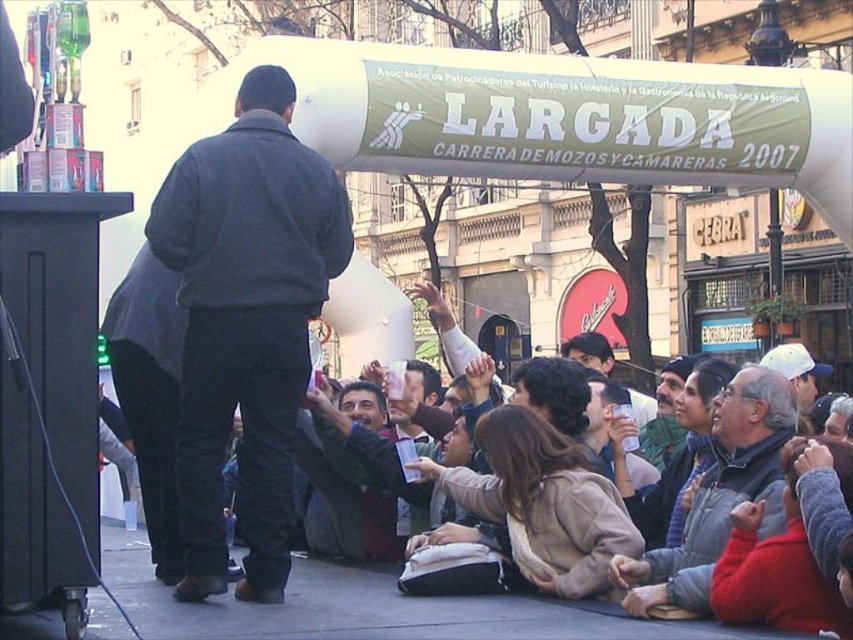
Question: Which object appears closest to the camera in this image?

Choices:
 (A) concrete pavement at lower center
 (B) smooth brown jacket at center
 (C) dark gray fleece jacket at center

Answer: (A)

Question: Which object appears closest to the camera in this image?

Choices:
 (A) concrete pavement at lower center
 (B) gray wool sweater at lower right
 (C) dark gray fleece jacket at center

Answer: (A)

Question: Does concrete pavement at lower center appear under gray wool sweater at lower right?

Choices:
 (A) yes
 (B) no

Answer: (A)

Question: Considering the relative positions of concrete pavement at lower center and gray wool sweater at lower right in the image provided, where is concrete pavement at lower center located with respect to gray wool sweater at lower right?

Choices:
 (A) left
 (B) right

Answer: (A)

Question: Among these points, which one is farthest from the camera?

Choices:
 (A) (601, 336)
 (B) (498, 634)

Answer: (A)

Question: Can you confirm if dark gray fleece jacket at center is positioned to the left of concrete pavement at lower center?

Choices:
 (A) no
 (B) yes

Answer: (B)